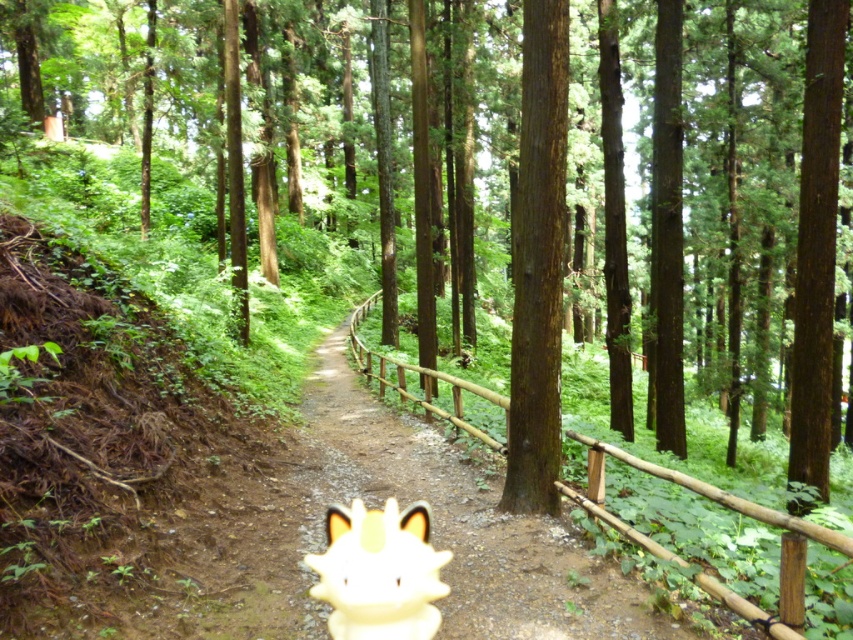
Question: Can you confirm if brown rough bark tree at center is positioned below white glossy figurine at center?

Choices:
 (A) no
 (B) yes

Answer: (A)

Question: Which of the following is the closest to the observer?

Choices:
 (A) brown rough bark tree at center
 (B) white glossy figurine at center

Answer: (B)

Question: Is brown rough bark tree at center above white glossy figurine at center?

Choices:
 (A) yes
 (B) no

Answer: (A)

Question: Among these points, which one is nearest to the camera?

Choices:
 (A) coord(364,550)
 (B) coord(521,344)

Answer: (A)

Question: Which point is closer to the camera?

Choices:
 (A) brown rough bark tree at center
 (B) white glossy figurine at center

Answer: (B)

Question: Is brown rough bark tree at center further to the viewer compared to white glossy figurine at center?

Choices:
 (A) yes
 (B) no

Answer: (A)